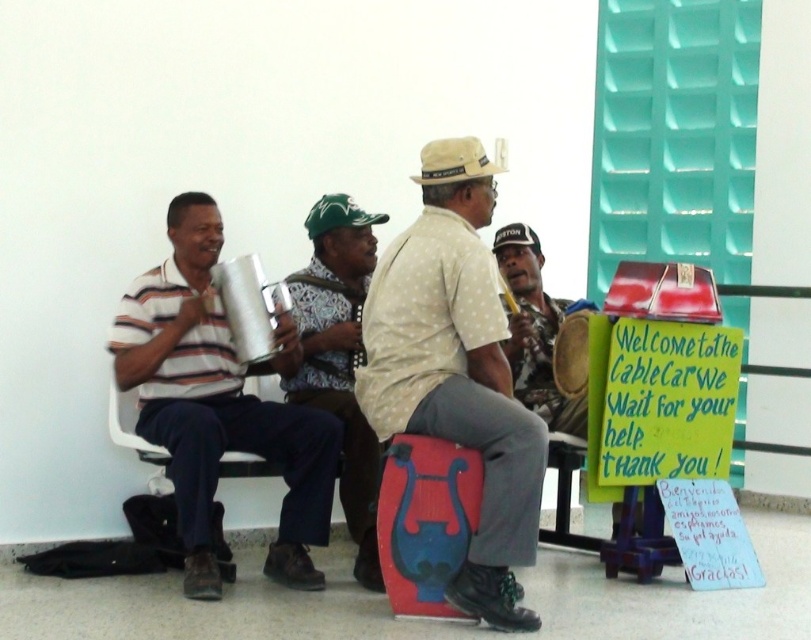
Can you confirm if matte brown hat at center is positioned below white cotton baseball cap at center?

Correct, matte brown hat at center is located below white cotton baseball cap at center.

Does point (535, 401) lie in front of point (539, 248)?

Yes, it is.

Find the location of a particular element. matte brown hat at center is located at coordinates (534, 332).

Does white dotted shirt at center have a lesser width compared to patterned fabric hat at center?

In fact, white dotted shirt at center might be wider than patterned fabric hat at center.

Can you confirm if white dotted shirt at center is positioned to the left of patterned fabric hat at center?

Incorrect, white dotted shirt at center is not on the left side of patterned fabric hat at center.

The image size is (811, 640). Find the location of `white dotted shirt at center`. white dotted shirt at center is located at coordinates (457, 371).

Describe the element at coordinates (457, 371) in the screenshot. I see `white dotted shirt at center` at that location.

Does point (483, 442) come in front of point (534, 353)?

Yes, point (483, 442) is in front of point (534, 353).

Which is in front, point (447, 340) or point (513, 253)?

Positioned in front is point (447, 340).

I want to click on white dotted shirt at center, so click(x=457, y=371).